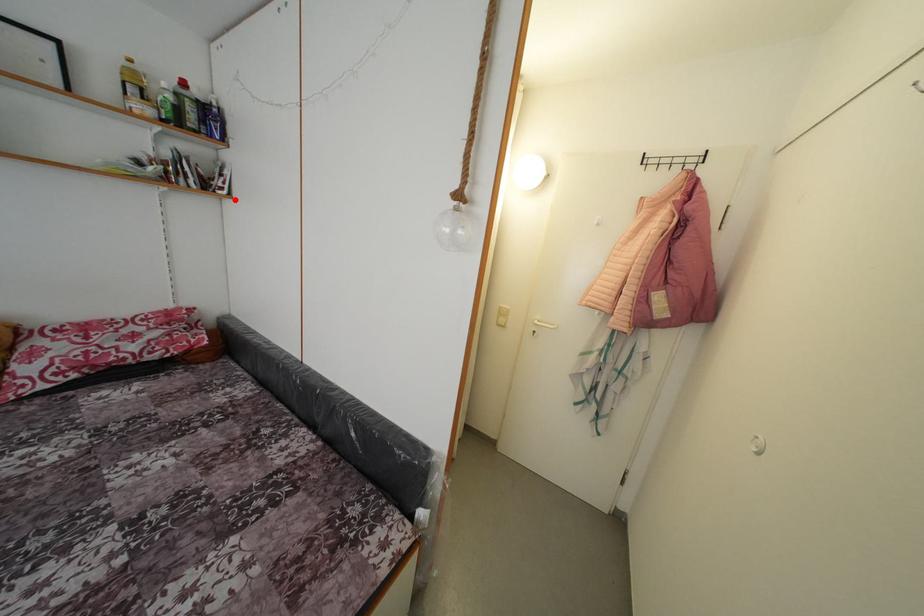
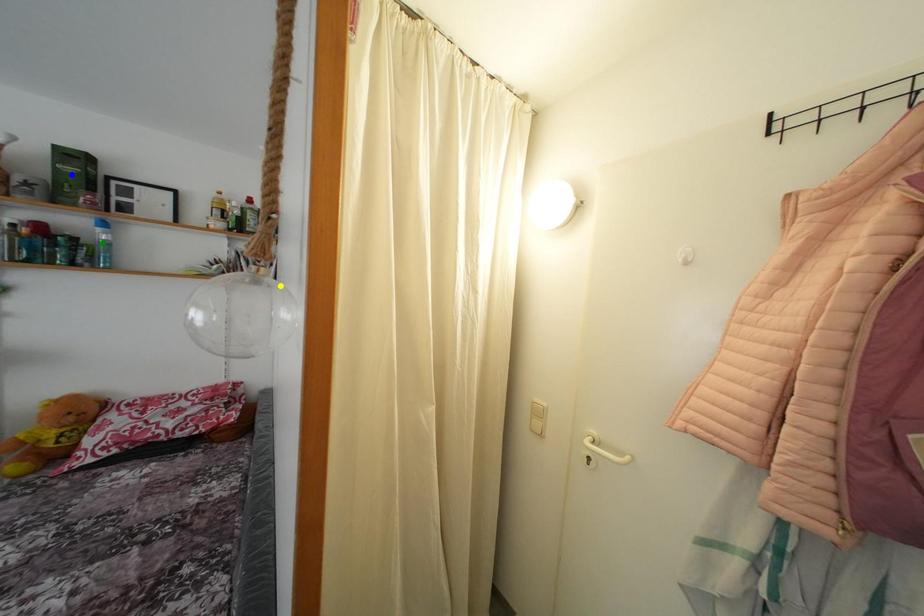
Question: I am providing you with two images of the same scene from different viewpoints. A red point is marked on the first image. You are given multiple points on the second image. Which spot in image 2 lines up with the point in image 1?

Choices:
 (A) blue point
 (B) yellow point
 (C) green point

Answer: (B)